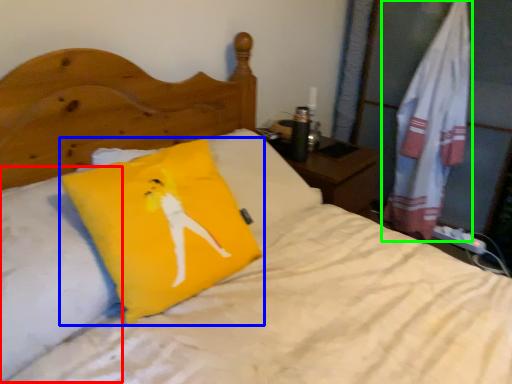
Question: Based on their relative distances, which object is farther from pillow (highlighted by a red box)? Choose from pillow (highlighted by a blue box) and material (highlighted by a green box).

Choices:
 (A) pillow
 (B) material

Answer: (B)